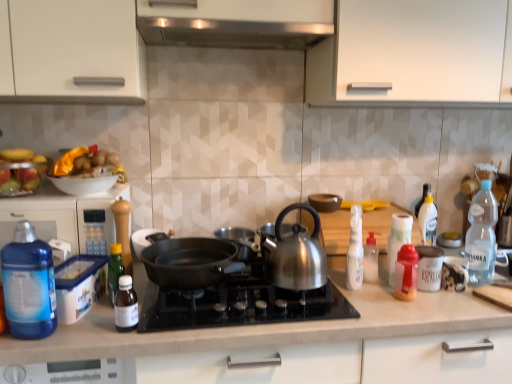
Find the location of `free spot to the left of translucent plastic bottle at lower left, marked as the sixth bottle in a right-to-left arrangement`. free spot to the left of translucent plastic bottle at lower left, marked as the sixth bottle in a right-to-left arrangement is located at coordinates (80, 330).